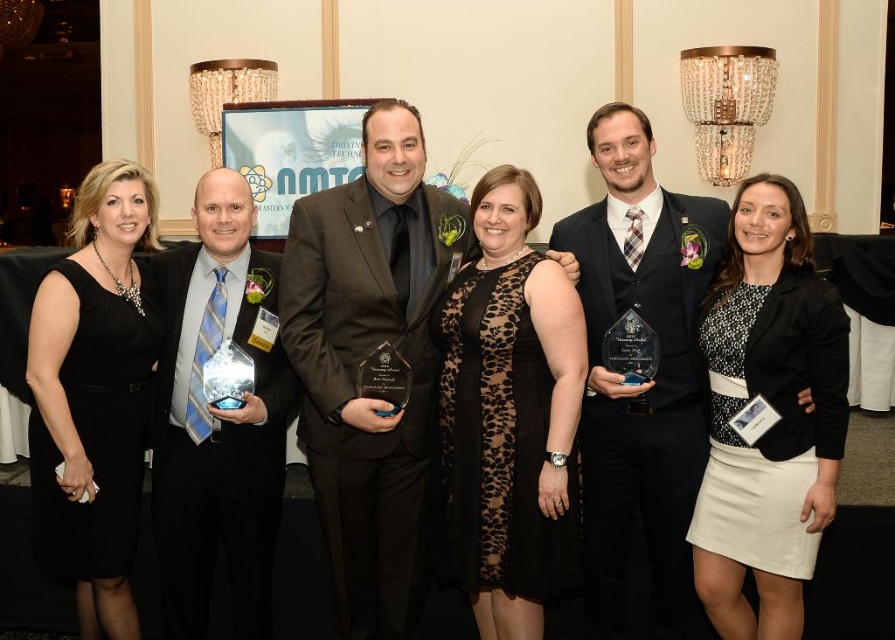
You are a photographer adjusting the camera settings to capture a clear photo of the matte black suit at center and the shiny silver award at center. The camera has a depth of field that can focus on objects within a 20 inch range. Will both objects be in focus?

The distance between the matte black suit at center and the shiny silver award at center is 21.93 inches, which exceeds the camera depth of field range of 20 inches. Therefore, both objects cannot be in focus simultaneously.

You are a photographer at the event and want to ensure all participants are visible in the photo. Considering the shiny dark blue suit at center and the black textured dress at center, which one might block the view of someone behind them?

The shiny dark blue suit at center is taller than the black textured dress at center, so it might block the view of someone behind them more than the black textured dress at center.